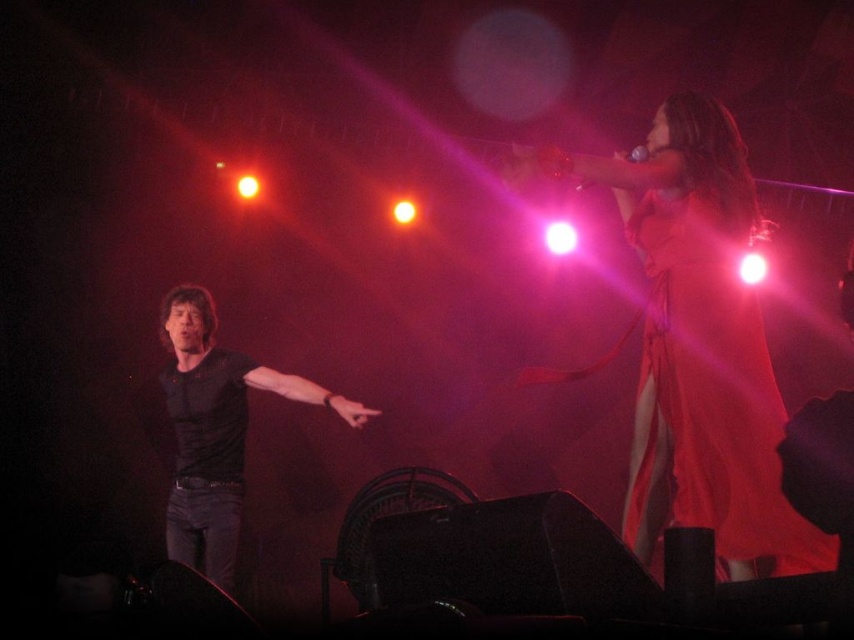
You are a photographer positioned at the back of the venue. You want to capture a closeup shot of the silky red dress at upper right. Given that your camera can focus on objects within 5 feet, will you need to move closer to achieve a clear photo?

The silky red dress at upper right is 7.54 feet away from the viewer. Since your camera can focus within 5 feet, you need to move closer to ensure the dress is within the 5 feet range for clear focus.

You are a photographer at the concert venue. You need to capture a photo where both the silky red dress at upper right and the black matte shirt at left are visible. Based on their positions, which one will appear smaller in the final photo?

The silky red dress at upper right will appear smaller in the photo because it is not as tall as the black matte shirt at left.

You are a photographer at the concert venue and want to capture a closeup of the female performer. You notice a point at coordinates (706, 400) on the image. Based on the scene description, where is this point located?

The point at coordinates (706, 400) is located on the silky red dress at upper right belonging to the female performer.